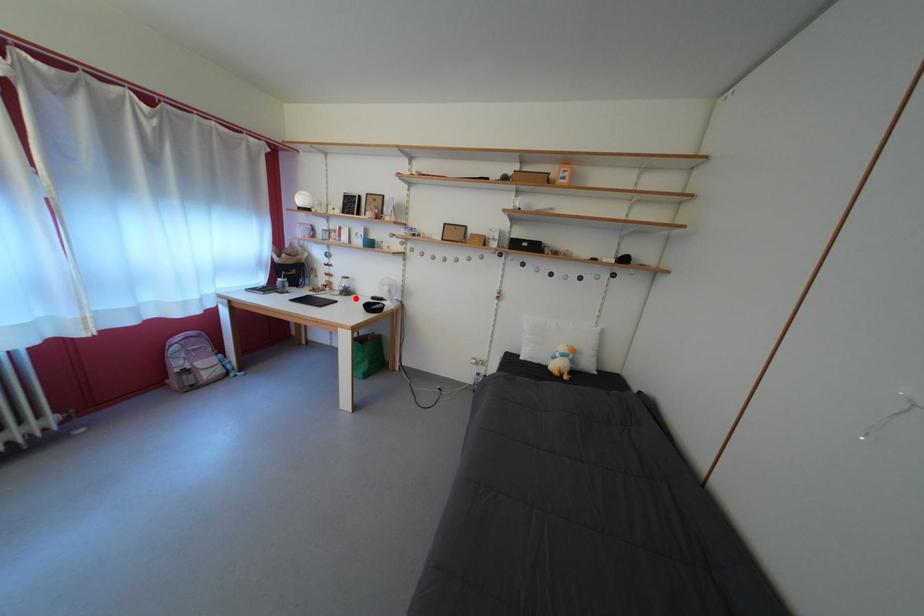
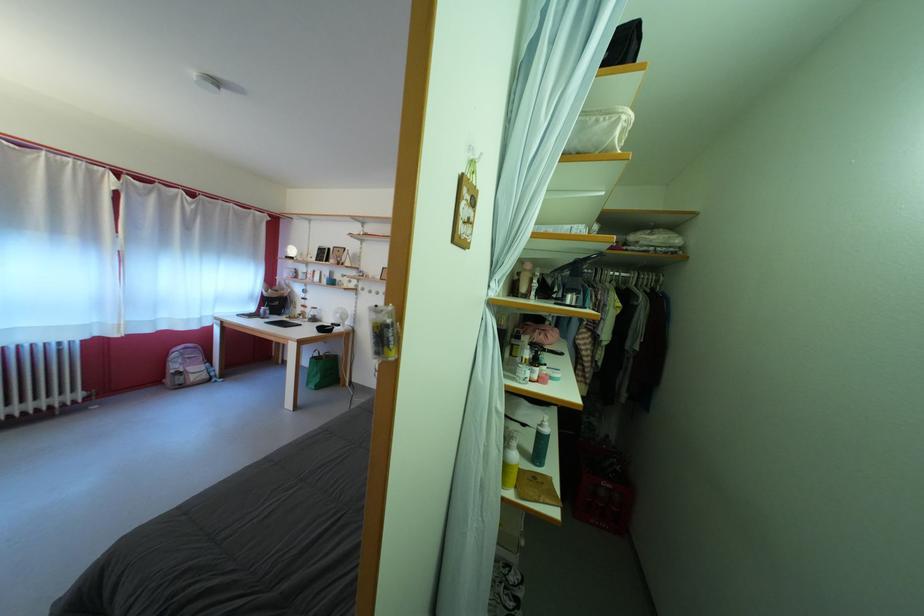
The point at the highlighted location is marked in the first image. Where is the corresponding point in the second image?

(322, 325)